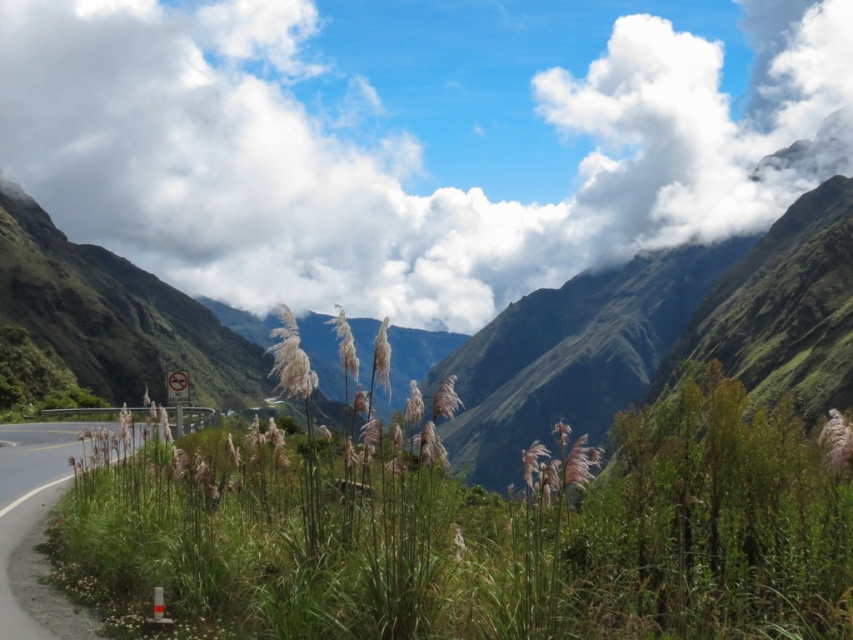
In the scene shown: Does white fluffy cloud at upper center have a greater height compared to green grass at lower left?

Yes, white fluffy cloud at upper center is taller than green grass at lower left.

Who is more forward, (x=349, y=76) or (x=32, y=477)?

Positioned in front is point (x=32, y=477).

Measure the distance between white fluffy cloud at upper center and camera.

A distance of 499.33 meters exists between white fluffy cloud at upper center and camera.

You are a GUI agent. You are given a task and a screenshot of the screen. Output one action in this format:
    pyautogui.click(x=<x>, y=<y>)
    Task: Click on the white fluffy cloud at upper center
    
    Given the screenshot: What is the action you would take?
    pyautogui.click(x=410, y=141)